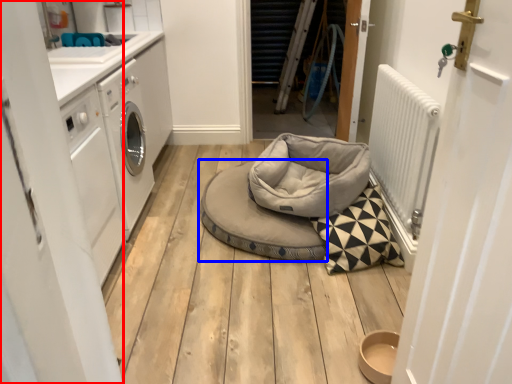
Question: Which object appears farthest to the camera in this image, door (highlighted by a red box) or dog bed (highlighted by a blue box)?

Choices:
 (A) door
 (B) dog bed

Answer: (B)